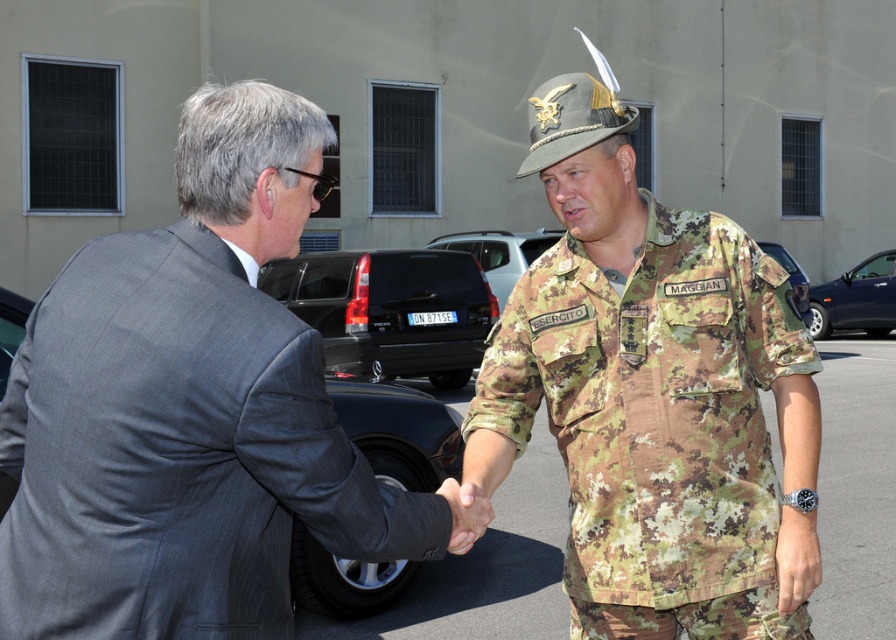
Between gray pinstripe suit at center and camouflage fabric uniform at center, which one appears on the left side from the viewer's perspective?

gray pinstripe suit at center

From the picture: Can you confirm if gray pinstripe suit at center is taller than camouflage fabric uniform at center?

In fact, gray pinstripe suit at center may be shorter than camouflage fabric uniform at center.

Who is more forward, (166, 228) or (719, 618)?

Point (166, 228)

You are a GUI agent. You are given a task and a screenshot of the screen. Output one action in this format:
    pyautogui.click(x=<x>, y=<y>)
    Task: Click on the gray pinstripe suit at center
    The height and width of the screenshot is (640, 896).
    Given the screenshot: What is the action you would take?
    pyautogui.click(x=190, y=410)